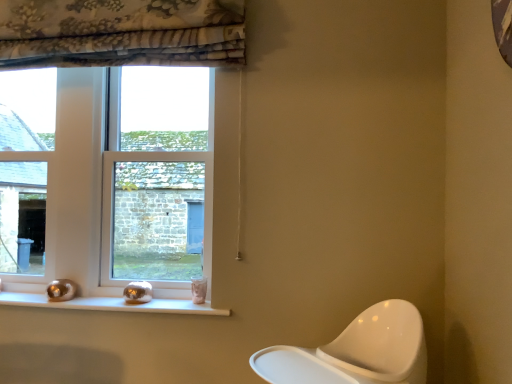
Question: Does clear glass window at left, the second window when ordered from right to left, have a greater width compared to clear glass window at center, which is the first window in right-to-left order?

Choices:
 (A) yes
 (B) no

Answer: (B)

Question: Is clear glass window at left, the second window when ordered from right to left, taller than clear glass window at center, the second window positioned from the left?

Choices:
 (A) no
 (B) yes

Answer: (B)

Question: Is clear glass window at left, the second window when ordered from right to left, facing towards clear glass window at center, which is the first window in right-to-left order?

Choices:
 (A) no
 (B) yes

Answer: (A)

Question: From the image's perspective, is clear glass window at left, the second window when ordered from right to left, beneath clear glass window at center, the second window positioned from the left?

Choices:
 (A) yes
 (B) no

Answer: (B)

Question: Is clear glass window at center, the second window positioned from the left, at the back of clear glass window at left, which is the 1th window from left to right?

Choices:
 (A) no
 (B) yes

Answer: (A)

Question: Is white glossy window sill at lower center situated inside clear glass window at left, the second window when ordered from right to left, or outside?

Choices:
 (A) outside
 (B) inside

Answer: (A)

Question: From the image's perspective, is white glossy window sill at lower center above or below clear glass window at left, which is the 1th window from left to right?

Choices:
 (A) above
 (B) below

Answer: (B)

Question: From a real-world perspective, is white glossy window sill at lower center above or below clear glass window at left, which is the 1th window from left to right?

Choices:
 (A) below
 (B) above

Answer: (A)

Question: Considering the positions of point (137, 304) and point (12, 259), is point (137, 304) closer or farther from the camera than point (12, 259)?

Choices:
 (A) farther
 (B) closer

Answer: (B)

Question: Considering the positions of clear glass window at left, the second window when ordered from right to left, and clear glass window at center, the second window positioned from the left, in the image, is clear glass window at left, the second window when ordered from right to left, bigger or smaller than clear glass window at center, the second window positioned from the left,?

Choices:
 (A) small
 (B) big

Answer: (A)

Question: In the image, is clear glass window at left, the second window when ordered from right to left, positioned in front of or behind clear glass window at center, which is the first window in right-to-left order?

Choices:
 (A) front
 (B) behind

Answer: (B)

Question: From the image's perspective, is clear glass window at left, the second window when ordered from right to left, located above or below clear glass window at center, the second window positioned from the left?

Choices:
 (A) above
 (B) below

Answer: (A)

Question: Considering the positions of point (12, 261) and point (160, 268), is point (12, 261) closer or farther from the camera than point (160, 268)?

Choices:
 (A) farther
 (B) closer

Answer: (A)

Question: Visually, is clear glass window at left, which is the 1th window from left to right, positioned to the left or to the right of white glossy window sill at lower center?

Choices:
 (A) right
 (B) left

Answer: (B)

Question: From the image's perspective, is clear glass window at left, which is the 1th window from left to right, positioned above or below white glossy window sill at lower center?

Choices:
 (A) below
 (B) above

Answer: (B)